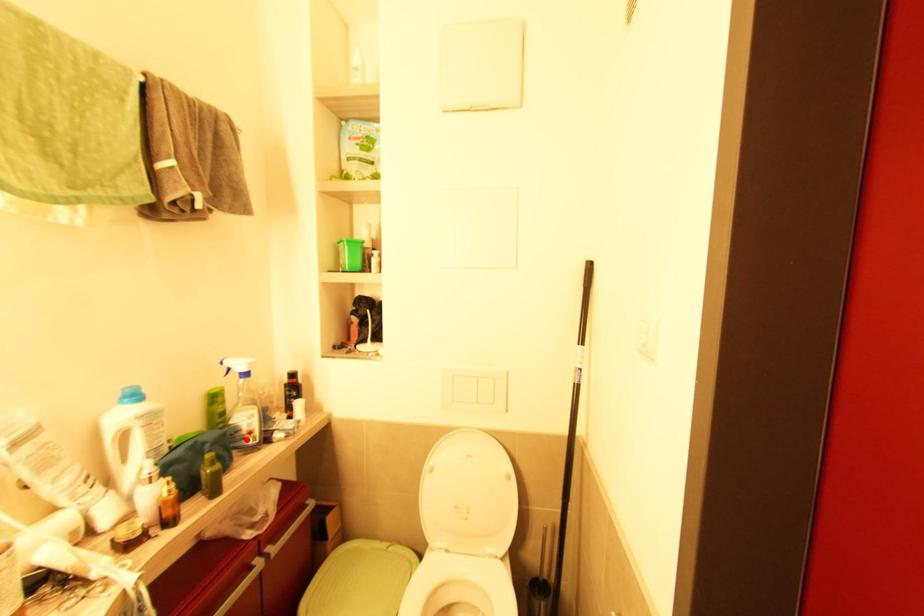
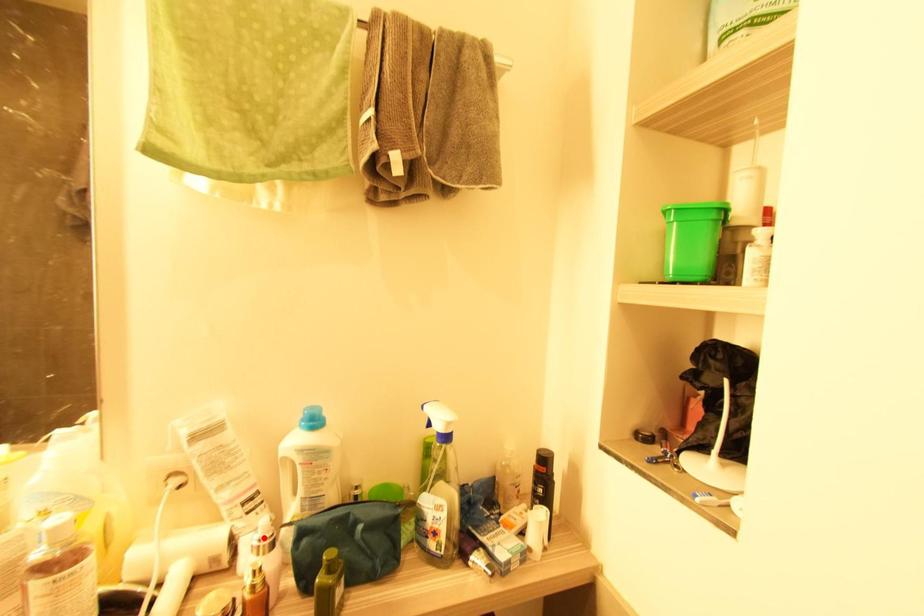
I am providing you with two images of the same scene from different viewpoints. A red point is marked on the first image and another point is marked on the second image. Are the points marked in image1 and image2 representing the same 3D position?

No